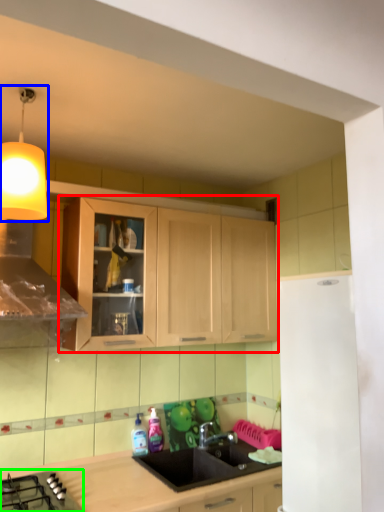
Question: Based on their relative distances, which object is nearer to cabinetry (highlighted by a red box)? Choose from light fixture (highlighted by a blue box) and gas stove (highlighted by a green box).

Choices:
 (A) light fixture
 (B) gas stove

Answer: (A)